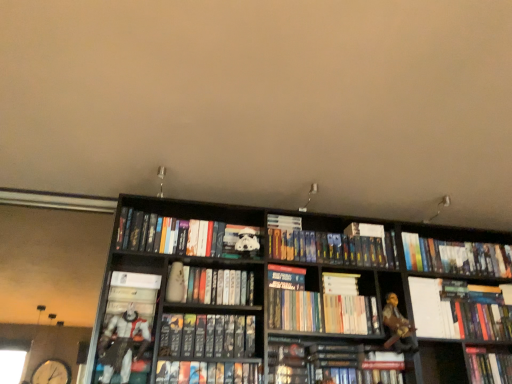
Question: Is hardcover book at center, positioned as the 8th book in left-to-right order, outside of white matte stormtrooper helmet at center, acting as the 10th book starting from the right?

Choices:
 (A) no
 (B) yes

Answer: (B)

Question: Is white matte stormtrooper helmet at center, acting as the 10th book starting from the right, located within hardcover book at center, positioned as the 8th book in left-to-right order?

Choices:
 (A) no
 (B) yes

Answer: (A)

Question: Is hardcover book at center, positioned as the 8th book in left-to-right order, smaller than white matte stormtrooper helmet at center, the 2th book in the left-to-right sequence?

Choices:
 (A) no
 (B) yes

Answer: (B)

Question: Are hardcover book at center, the 4th book from the right, and white matte stormtrooper helmet at center, the 2th book in the left-to-right sequence, making contact?

Choices:
 (A) yes
 (B) no

Answer: (B)

Question: Does hardcover book at center, the 4th book from the right, have a larger size compared to white matte stormtrooper helmet at center, the 2th book in the left-to-right sequence?

Choices:
 (A) no
 (B) yes

Answer: (A)

Question: From the image's perspective, relative to white glossy book at right, which is the 2th book from right to left, is white paper at upper right above or below?

Choices:
 (A) below
 (B) above

Answer: (B)

Question: Considering the positions of point (414, 309) and point (498, 319), is point (414, 309) closer or farther from the camera than point (498, 319)?

Choices:
 (A) closer
 (B) farther

Answer: (A)

Question: Is white paper at upper right inside or outside of white glossy book at right, the tenth book positioned from the left?

Choices:
 (A) inside
 (B) outside

Answer: (B)

Question: Looking at their shapes, would you say white paper at upper right is wider or thinner than white glossy book at right, which is the 2th book from right to left?

Choices:
 (A) thin
 (B) wide

Answer: (B)

Question: Is hardcover book at center, the 4th book from the left, in front of or behind white paper at upper right in the image?

Choices:
 (A) front
 (B) behind

Answer: (A)

Question: Is hardcover book at center, the 4th book from the left, inside the boundaries of white paper at upper right, or outside?

Choices:
 (A) inside
 (B) outside

Answer: (B)

Question: Based on their sizes in the image, would you say hardcover book at center, the 4th book from the left, is bigger or smaller than white paper at upper right?

Choices:
 (A) big
 (B) small

Answer: (A)

Question: Considering the positions of hardcover book at center, marked as the 8th book in a right-to-left arrangement, and white paper at upper right in the image, is hardcover book at center, marked as the 8th book in a right-to-left arrangement, taller or shorter than white paper at upper right?

Choices:
 (A) short
 (B) tall

Answer: (A)

Question: In terms of height, does hardcover book at center, the 4th book from the right, look taller or shorter compared to hardcover books at center, the 5th book from the right?

Choices:
 (A) short
 (B) tall

Answer: (A)

Question: Looking at the image, does hardcover book at center, the 4th book from the right, seem bigger or smaller compared to hardcover books at center, arranged as the 7th book when viewed from the left?

Choices:
 (A) small
 (B) big

Answer: (B)